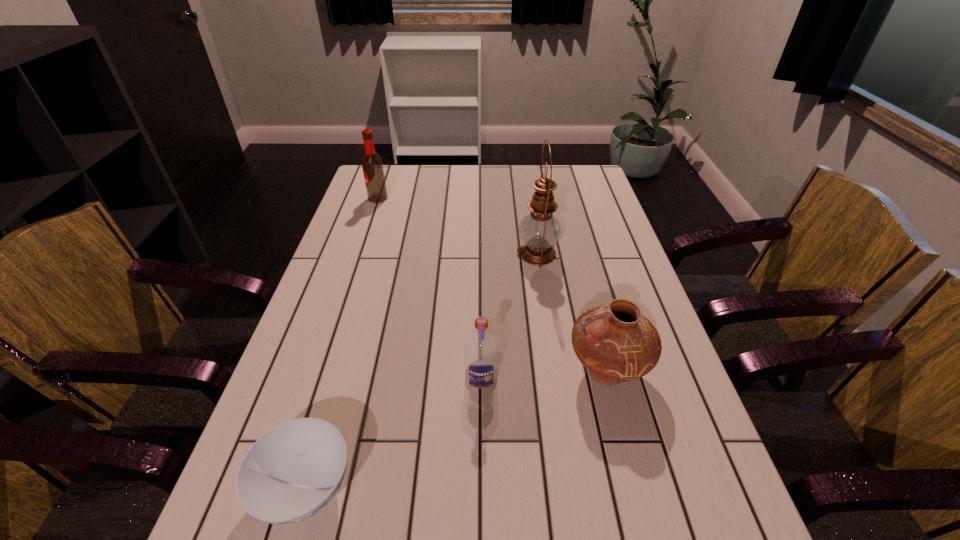
This screenshot has height=540, width=960. Find the location of `vacant area that lies between the third object from left to right and the pottery`. vacant area that lies between the third object from left to right and the pottery is located at coordinates 544,374.

Locate an element on the screen. free spot between the beer bottle and the vodka is located at coordinates (429, 288).

Where is `free point between the vodka and the tallest object`? free point between the vodka and the tallest object is located at coordinates (509, 315).

Image resolution: width=960 pixels, height=540 pixels. What are the coordinates of `vacant space that is in between the farthest object and the third object from right to left` in the screenshot? It's located at click(429, 288).

This screenshot has height=540, width=960. Identify the location of free space that is in between the vodka and the tallest object. (509, 315).

Identify the location of empty location between the third object from right to left and the pottery. (544, 374).

At what (x,y) coordinates should I click in order to perform the action: click on object that stands as the third closest to the shortest object. Please return your answer as a coordinate pair (x, y). Looking at the image, I should click on (539, 230).

Identify which object is located as the fourth nearest to the pottery. Please provide its 2D coordinates. Your answer should be formatted as a tuple, i.e. [(x, y)], where the tuple contains the x and y coordinates of a point satisfying the conditions above.

[(372, 165)]

Image resolution: width=960 pixels, height=540 pixels. I want to click on vacant space that satisfies the following two spatial constraints: 1. on the front side of the second tallest object; 2. on the side of the pottery with the handle, so click(x=321, y=371).

You are a GUI agent. You are given a task and a screenshot of the screen. Output one action in this format:
    pyautogui.click(x=<x>, y=<y>)
    Task: Click on the vacant space that satisfies the following two spatial constraints: 1. on the front side of the fourth shortest object; 2. on the right side of the oil lamp
    This screenshot has height=540, width=960.
    Given the screenshot: What is the action you would take?
    pyautogui.click(x=359, y=254)